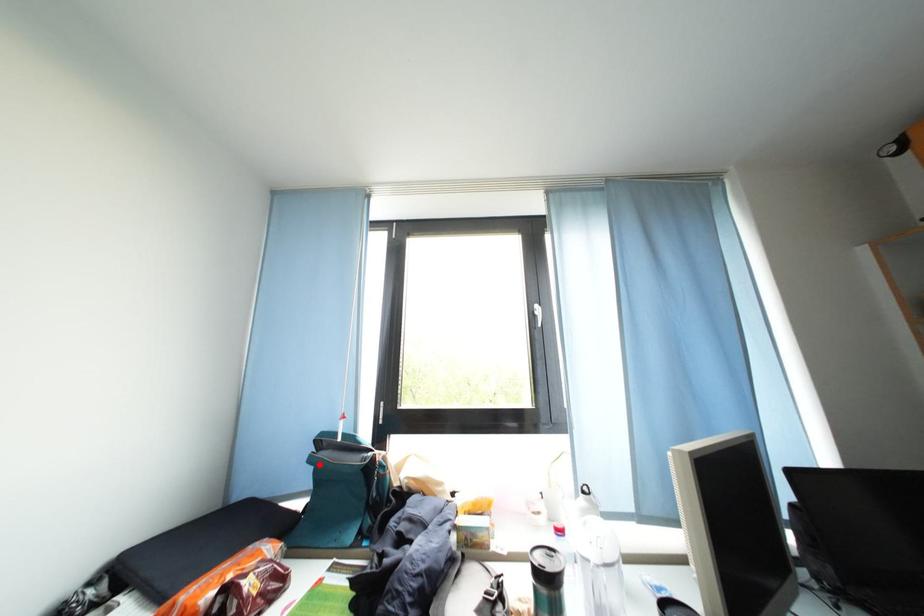
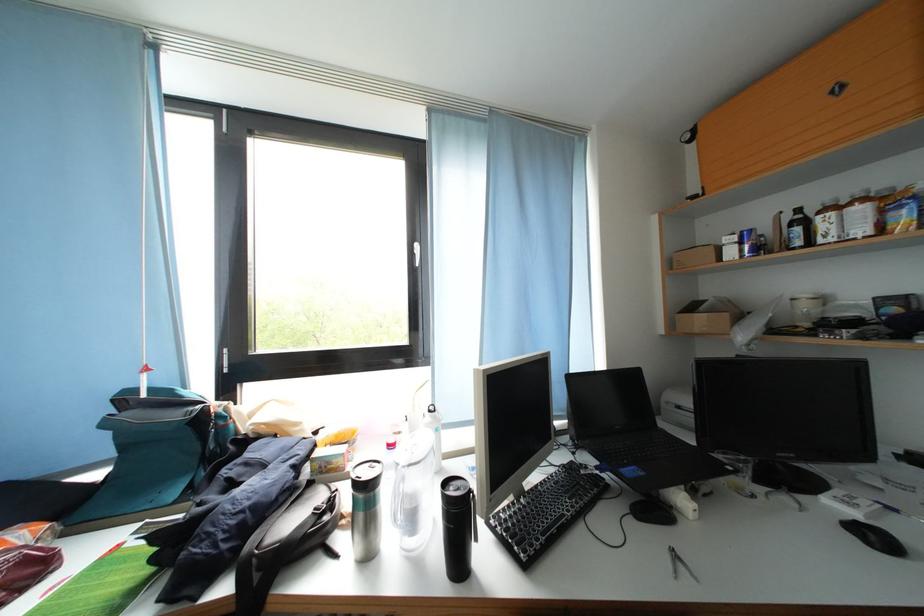
Question: I am providing you with two images of the same scene from different viewpoints. Given a red point in image1, look at the same physical point in image2. Is it:

Choices:
 (A) Closer to the viewpoint
 (B) Farther from the viewpoint

Answer: (A)